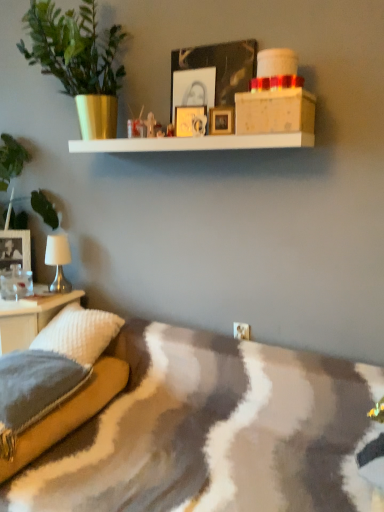
Question: Considering the relative positions of white matte table lamp at left and gold metallic picture frame at upper center, which ranks as the first picture frame in front-to-back order, in the image provided, is white matte table lamp at left to the right of gold metallic picture frame at upper center, which ranks as the first picture frame in front-to-back order, from the viewer's perspective?

Choices:
 (A) no
 (B) yes

Answer: (A)

Question: Is white matte table lamp at left facing away from gold metallic picture frame at upper center, arranged as the 2th picture frame when ordered from the bottom?

Choices:
 (A) yes
 (B) no

Answer: (B)

Question: Considering the relative sizes of white matte table lamp at left and gold metallic picture frame at upper center, arranged as the first picture frame when viewed from the right, in the image provided, is white matte table lamp at left taller than gold metallic picture frame at upper center, arranged as the first picture frame when viewed from the right,?

Choices:
 (A) no
 (B) yes

Answer: (B)

Question: Does white matte table lamp at left have a lesser height compared to gold metallic picture frame at upper center, which ranks as the 4th picture frame in back-to-front order?

Choices:
 (A) yes
 (B) no

Answer: (B)

Question: Would you say white matte table lamp at left is outside gold metallic picture frame at upper center, the 4th picture frame when ordered from left to right?

Choices:
 (A) no
 (B) yes

Answer: (B)

Question: Is white matte table lamp at left thinner than gold metallic picture frame at upper center, the 4th picture frame when ordered from left to right?

Choices:
 (A) yes
 (B) no

Answer: (B)

Question: From the image's perspective, would you say green matte plant at left is positioned over white glossy table at lower left?

Choices:
 (A) no
 (B) yes

Answer: (B)

Question: From a real-world perspective, is green matte plant at left located beneath white glossy table at lower left?

Choices:
 (A) yes
 (B) no

Answer: (B)

Question: Can you confirm if green matte plant at left is shorter than white glossy table at lower left?

Choices:
 (A) no
 (B) yes

Answer: (A)

Question: Does green matte plant at left have a greater height compared to white glossy table at lower left?

Choices:
 (A) yes
 (B) no

Answer: (A)

Question: Is green matte plant at left positioned with its back to white glossy table at lower left?

Choices:
 (A) no
 (B) yes

Answer: (A)

Question: Is green matte plant at left bigger than white glossy table at lower left?

Choices:
 (A) no
 (B) yes

Answer: (B)

Question: From a real-world perspective, is green matte plant at left positioned over wooden picture frame at upper center, arranged as the 2th picture frame when viewed from the left, based on gravity?

Choices:
 (A) yes
 (B) no

Answer: (A)